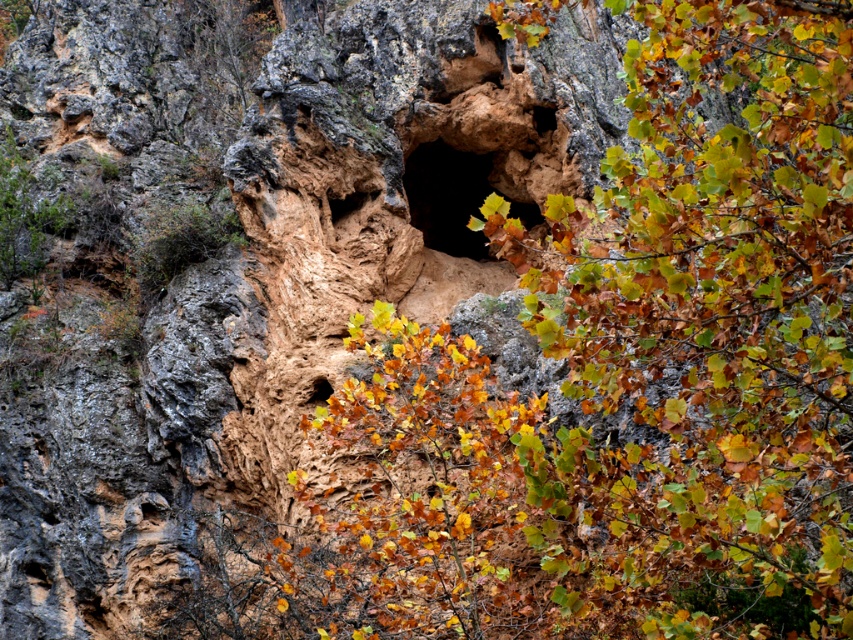
You are standing in front of the rugged rock formation and want to determine which of the two points, point (463, 243) or point (323, 388), is closer to you. Which one should you choose?

Point (463, 243) is further to the viewer than point (323, 388), so the closer point to you is point (323, 388).

You are a geologist examining the rock formation and notice two holes. Which hole, the dark rock hole at center or the brown rough hole at center, is farther away from you?

The brown rough hole at center is farther away from you because it is positioned behind the dark rock hole at center.